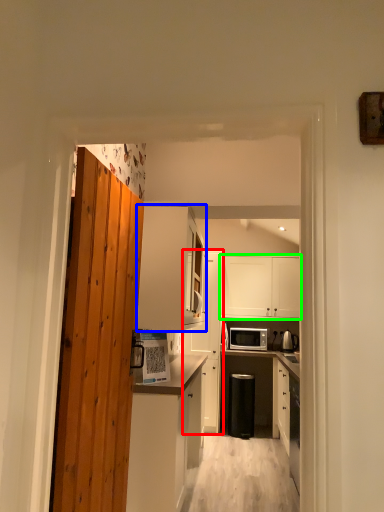
Question: Estimate the real-world distances between objects in this image. Which object is closer to cabinetry (highlighted by a red box), cabinetry (highlighted by a blue box) or cabinetry (highlighted by a green box)?

Choices:
 (A) cabinetry
 (B) cabinetry

Answer: (B)